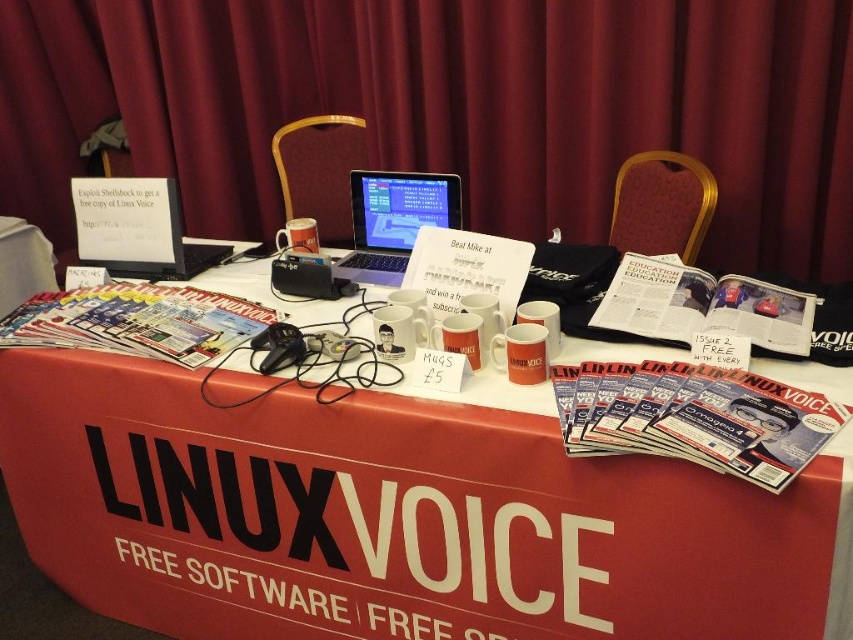
In the scene shown: Does maroon fabric curtain at upper center appear on the right side of silver metallic laptop at center?

Indeed, maroon fabric curtain at upper center is positioned on the right side of silver metallic laptop at center.

Can you confirm if maroon fabric curtain at upper center is smaller than silver metallic laptop at center?

Incorrect, maroon fabric curtain at upper center is not smaller in size than silver metallic laptop at center.

Who is more distant from viewer, [761,225] or [364,225]?

Point [761,225]

You are a GUI agent. You are given a task and a screenshot of the screen. Output one action in this format:
    pyautogui.click(x=<x>, y=<y>)
    Task: Click on the maroon fabric curtain at upper center
    The image size is (853, 640).
    Given the screenshot: What is the action you would take?
    pyautogui.click(x=450, y=108)

Is the position of white glossy mugs at center more distant than that of maroon fabric curtain at upper center?

No, white glossy mugs at center is closer to the viewer.

Measure the distance from white glossy mugs at center to maroon fabric curtain at upper center.

A distance of 1.33 meters exists between white glossy mugs at center and maroon fabric curtain at upper center.

Does point (773, 634) lie in front of point (418, 84)?

That is True.

Identify the location of white glossy mugs at center. (405, 516).

Describe the element at coordinates (405, 516) in the screenshot. I see `white glossy mugs at center` at that location.

Which of these two, white glossy mugs at center or silver metallic laptop at center, stands shorter?

silver metallic laptop at center is shorter.

This screenshot has width=853, height=640. I want to click on white glossy mugs at center, so click(x=405, y=516).